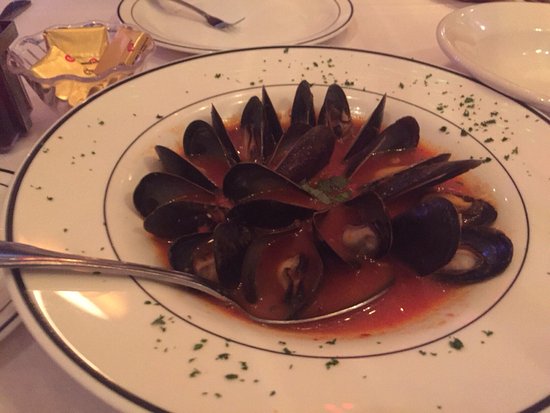
You are a GUI agent. You are given a task and a screenshot of the screen. Output one action in this format:
    pyautogui.click(x=<x>, y=<y>)
    Task: Click on the empty plates
    The width and height of the screenshot is (550, 413).
    Given the screenshot: What is the action you would take?
    pyautogui.click(x=304, y=15), pyautogui.click(x=516, y=46)